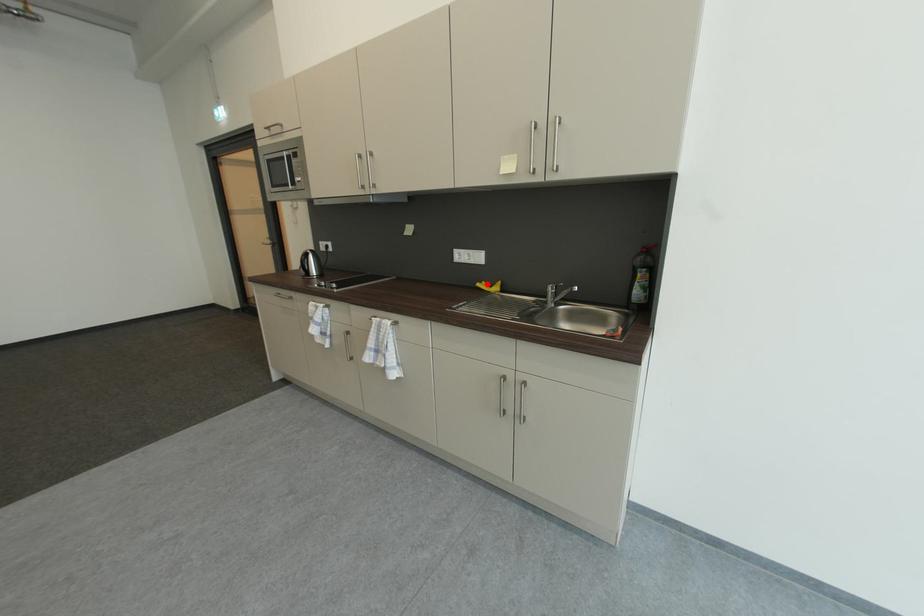
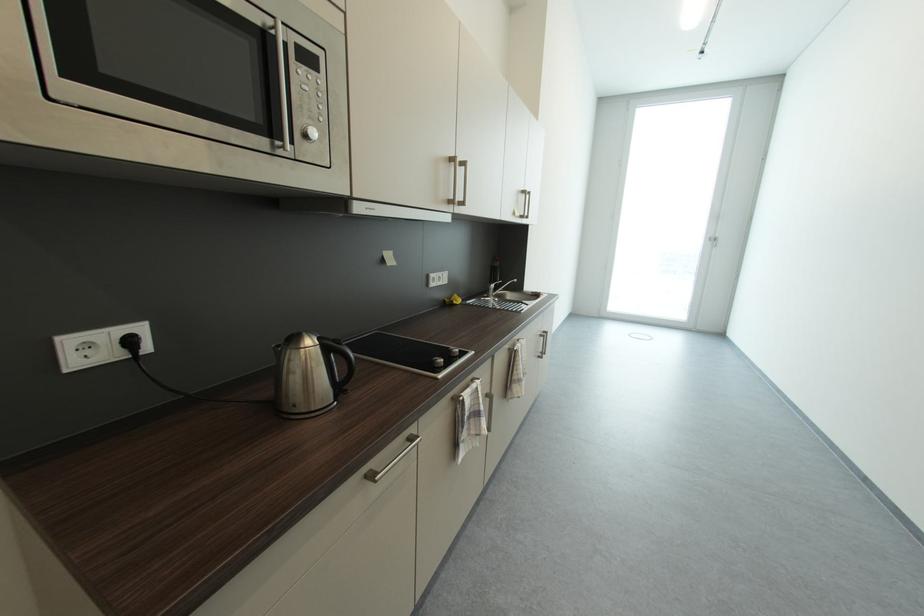
Question: I am providing you with two images of the same scene from different viewpoints. A red point is marked on the first image. Is the red point's position out of view in image 2?

Choices:
 (A) Yes
 (B) No

Answer: (B)